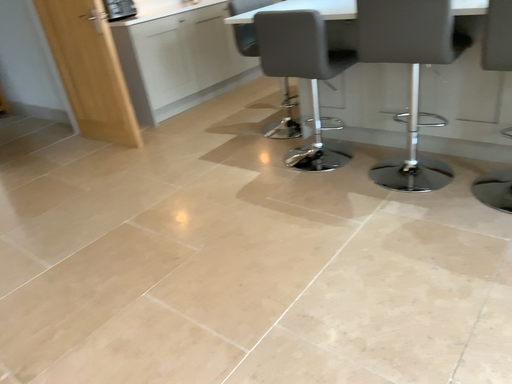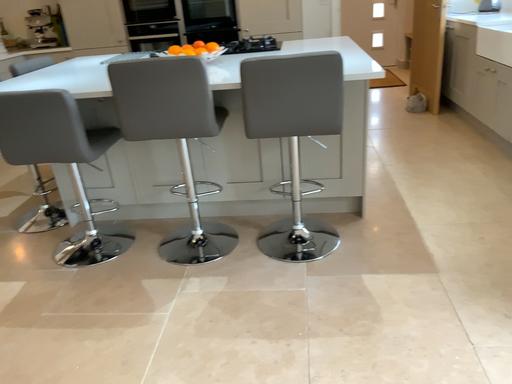
Question: Which way did the camera rotate in the video?

Choices:
 (A) rotated left
 (B) rotated right

Answer: (B)